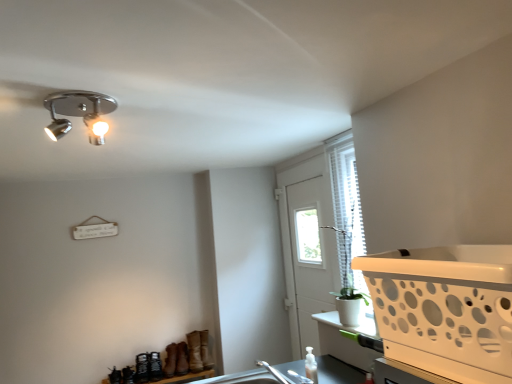
Question: Considering the relative positions of white plastic screen door at center and translucent plastic bottle at lower center in the image provided, is white plastic screen door at center to the left or to the right of translucent plastic bottle at lower center?

Choices:
 (A) left
 (B) right

Answer: (B)

Question: Considering the positions of point (324, 236) and point (305, 370), is point (324, 236) closer or farther from the camera than point (305, 370)?

Choices:
 (A) farther
 (B) closer

Answer: (A)

Question: Which of these objects is positioned closest to the white plastic screen door at center?

Choices:
 (A) translucent plastic bottle at lower center
 (B) chrome/metallic spotlight at upper left
 (C) white plastic basket at right

Answer: (A)

Question: Considering the real-world distances, which object is closest to the white plastic basket at right?

Choices:
 (A) chrome/metallic spotlight at upper left
 (B) translucent plastic bottle at lower center
 (C) white plastic screen door at center

Answer: (A)